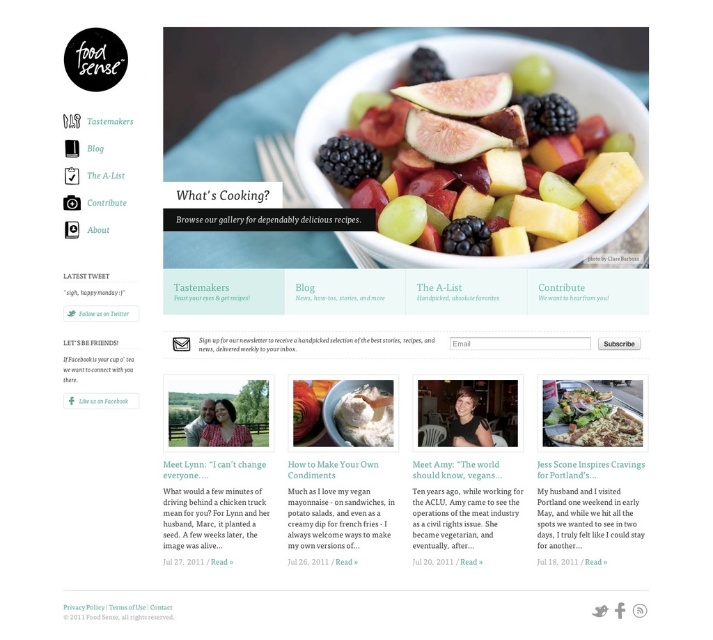
Who is lower down, green leafy salad at center or white fluffy cloud at center?

white fluffy cloud at center is below.

Does green leafy salad at center come behind white fluffy cloud at center?

No, it is not.

The width and height of the screenshot is (713, 640). Describe the element at coordinates (588, 417) in the screenshot. I see `green leafy salad at center` at that location.

Image resolution: width=713 pixels, height=640 pixels. I want to click on green leafy salad at center, so click(x=588, y=417).

Is matte white bowl at center wider than green leafy salad at center?

Indeed, matte white bowl at center has a greater width compared to green leafy salad at center.

Is matte white bowl at center behind green leafy salad at center?

Yes.

This screenshot has height=640, width=713. Describe the element at coordinates (584, 116) in the screenshot. I see `matte white bowl at center` at that location.

The width and height of the screenshot is (713, 640). Find the location of `matte white bowl at center`. matte white bowl at center is located at coordinates (584, 116).

Between matte white bowl at center and white fluffy cloud at center, which one appears on the right side from the viewer's perspective?

matte white bowl at center is more to the right.

Is matte white bowl at center smaller than white fluffy cloud at center?

Actually, matte white bowl at center might be larger than white fluffy cloud at center.

Which is behind, point (580, 72) or point (369, 424)?

Point (580, 72)

Locate an element on the screen. This screenshot has width=713, height=640. matte white bowl at center is located at coordinates (584, 116).